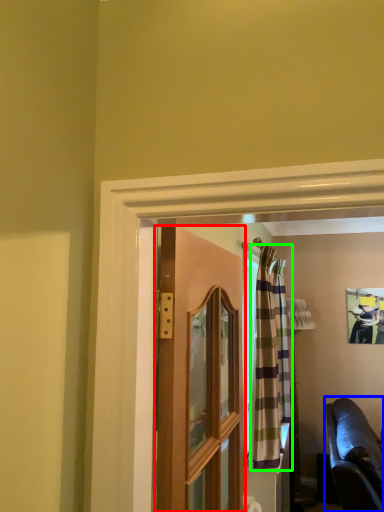
Question: Which object is the farthest from door (highlighted by a red box)? Choose among these: studio couch (highlighted by a blue box) or curtain (highlighted by a green box).

Choices:
 (A) studio couch
 (B) curtain

Answer: (A)